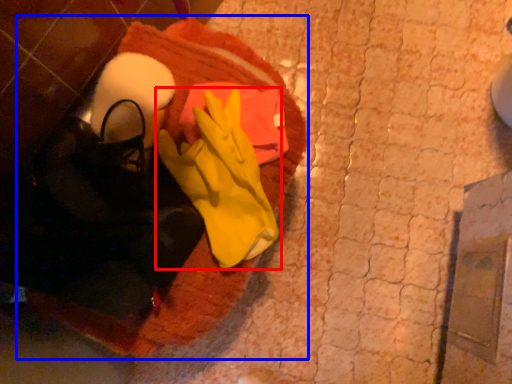
Question: Which point is further to the camera, glove (highlighted by a red box) or blanket (highlighted by a blue box)?

Choices:
 (A) glove
 (B) blanket

Answer: (B)